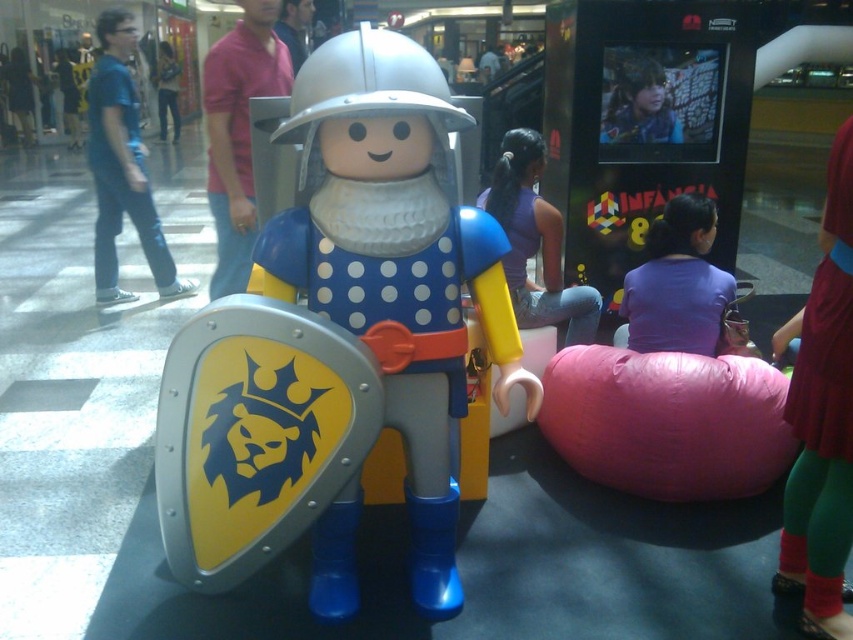
Question: From the image, what is the correct spatial relationship of matte plastic toy at center in relation to purple fabric at center?

Choices:
 (A) below
 (B) above

Answer: (A)

Question: Does purple matte shirt at lower right lie behind smooth brown hair at upper center?

Choices:
 (A) yes
 (B) no

Answer: (B)

Question: Which of these objects is positioned farthest from the matte blue jeans at left?

Choices:
 (A) brushed metal helmet at upper center
 (B) smooth brown hair at upper center
 (C) white matte helmet at center
 (D) red fabric dress at lower right

Answer: (D)

Question: Which object is closer to the camera taking this photo?

Choices:
 (A) white matte helmet at center
 (B) matte blue jeans at left

Answer: (A)

Question: Which of the following is the closest to the observer?

Choices:
 (A) matte blue jeans at left
 (B) brushed metal phone at upper left
 (C) smooth brown hair at upper center

Answer: (C)

Question: Is purple matte shirt at lower right below brushed metal helmet at upper center?

Choices:
 (A) yes
 (B) no

Answer: (A)